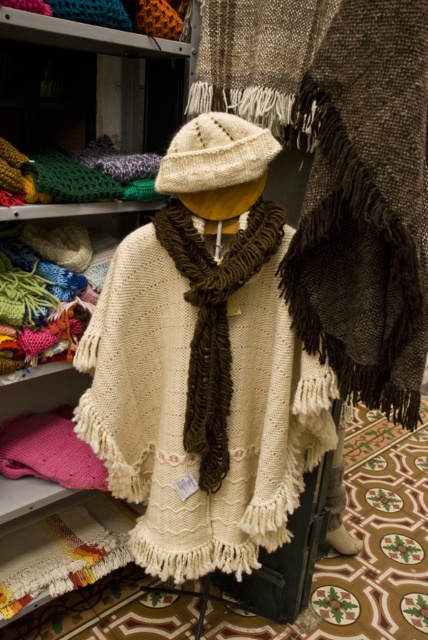
Question: Which point is closer to the camera taking this photo?

Choices:
 (A) (299, 392)
 (B) (228, 285)

Answer: (B)

Question: Can you confirm if white knitted poncho at center is wider than dark brown textured shawl at center?

Choices:
 (A) no
 (B) yes

Answer: (B)

Question: Which point is closer to the camera taking this photo?

Choices:
 (A) (225, 472)
 (B) (413, 108)
 (C) (219, 452)

Answer: (B)

Question: Which point appears farthest from the camera in this image?

Choices:
 (A) click(x=210, y=401)
 (B) click(x=205, y=460)

Answer: (B)

Question: Does dark brown textured shawl at center have a greater width compared to brown knitted scarf at center?

Choices:
 (A) yes
 (B) no

Answer: (B)

Question: Is dark brown textured shawl at center positioned in front of brown knitted scarf at center?

Choices:
 (A) yes
 (B) no

Answer: (A)